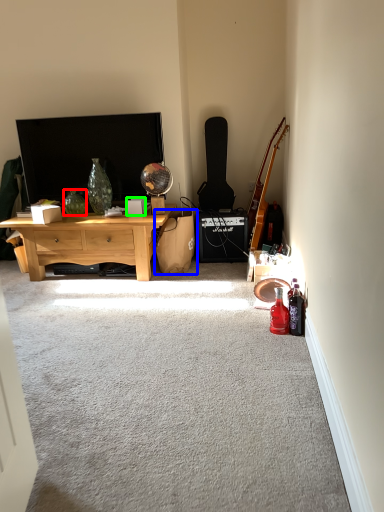
Question: Estimate the real-world distances between objects in this image. Which object is closer to vase (highlighted by a red box), handbag (highlighted by a blue box) or box (highlighted by a green box)?

Choices:
 (A) handbag
 (B) box

Answer: (B)